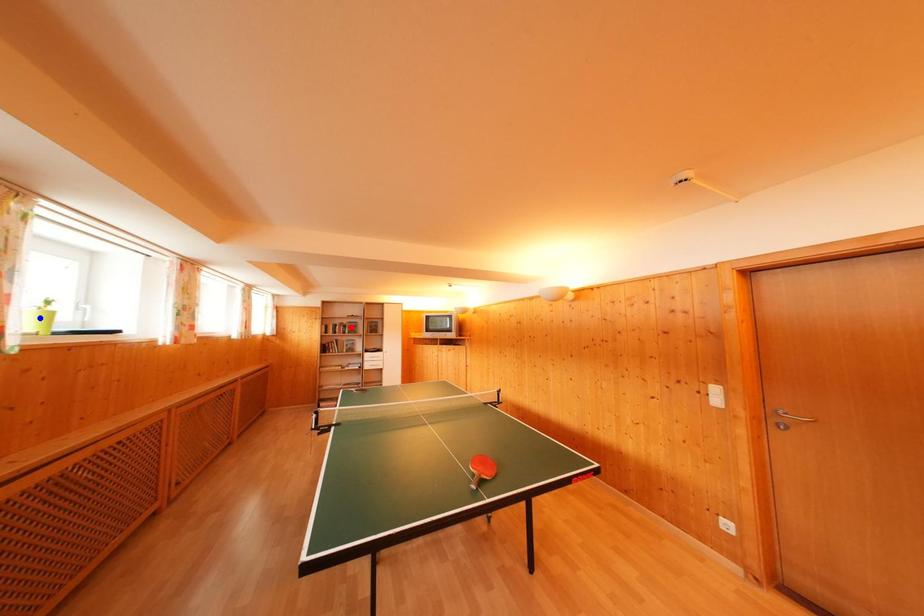
Question: In the image, two points are highlighted. Which point is nearer to the camera? Reply with the corresponding letter.

Choices:
 (A) blue point
 (B) red point

Answer: (A)